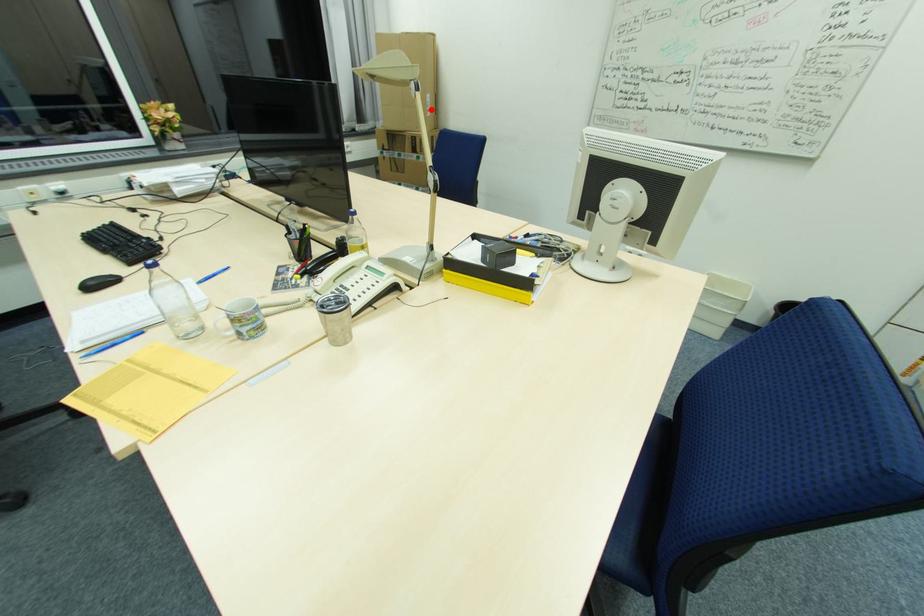
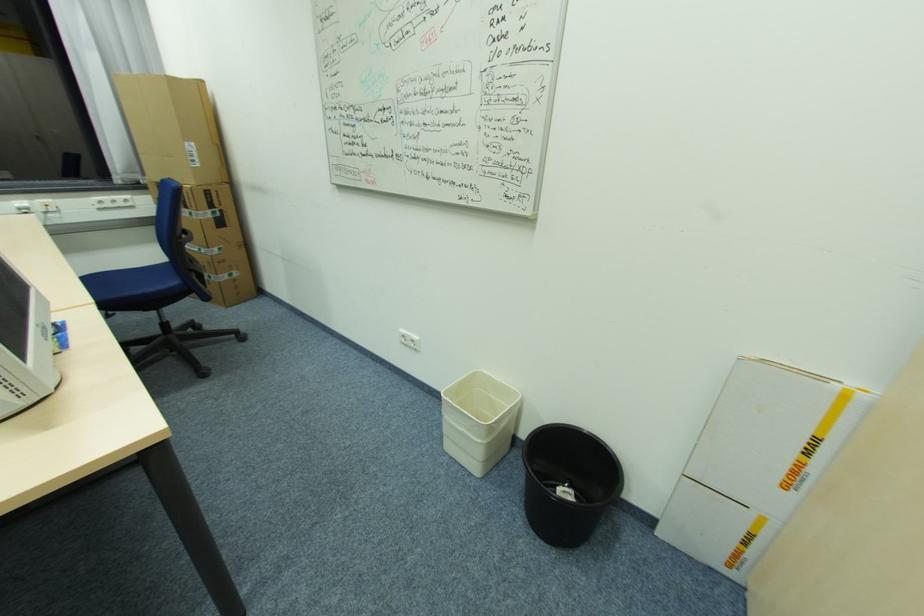
Question: I am providing you with two images of the same scene from different viewpoints. Given a red point in image1, look at the same physical point in image2. Is it:

Choices:
 (A) Closer to the viewpoint
 (B) Farther from the viewpoint

Answer: (B)